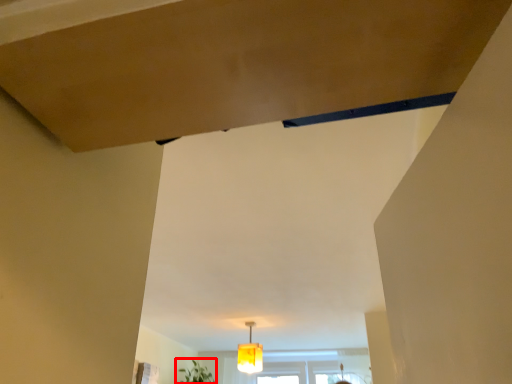
Question: From the image's perspective, considering the relative positions of plant (annotated by the red box) and lamp in the image provided, where is plant (annotated by the red box) located with respect to the staircase?

Choices:
 (A) below
 (B) above

Answer: (A)